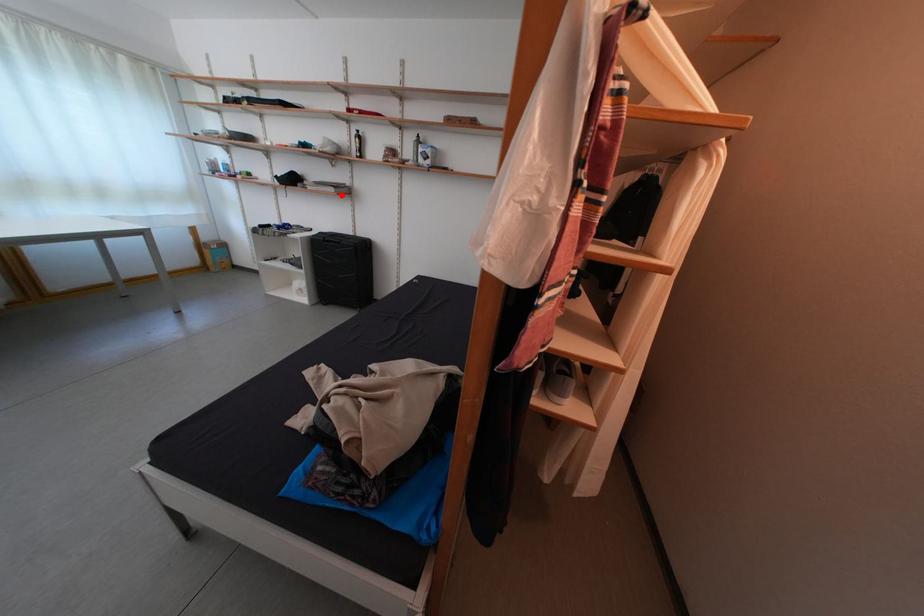
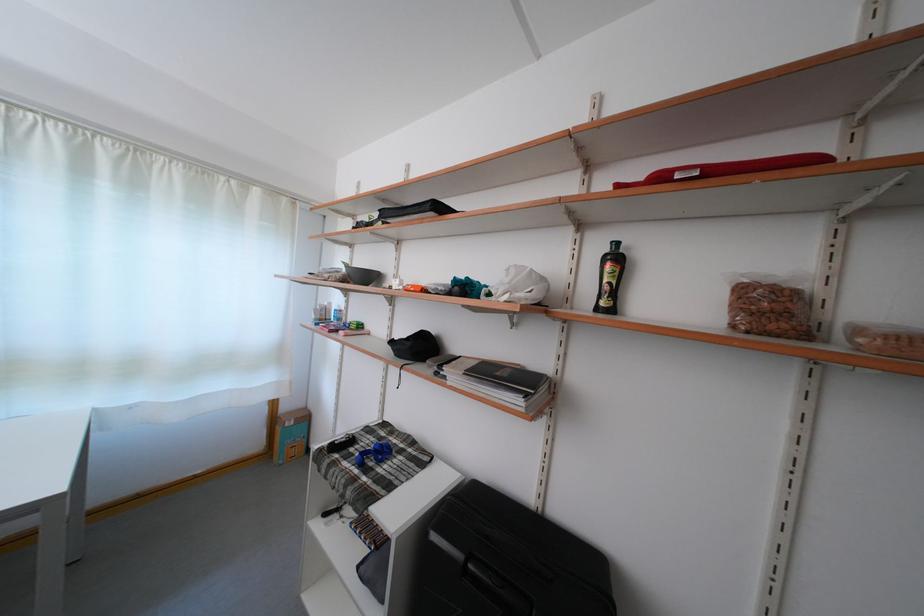
The point at the highlighted location is marked in the first image. Where is the corresponding point in the second image?

(527, 408)